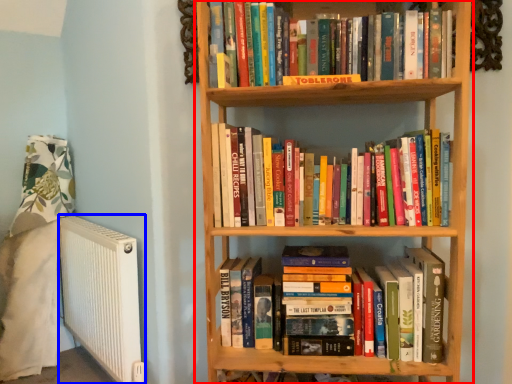
Question: Which object is closer to the camera taking this photo, bookcase (highlighted by a red box) or radiator (highlighted by a blue box)?

Choices:
 (A) bookcase
 (B) radiator

Answer: (A)